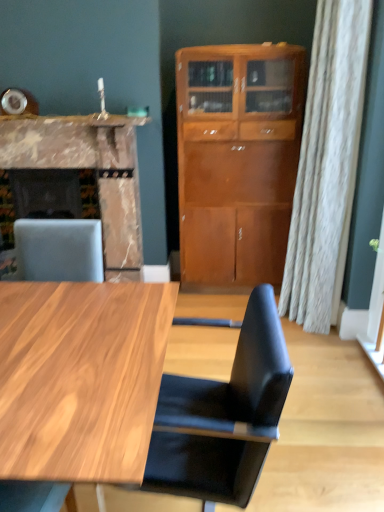
Question: Could you tell me if marble countertop at upper left is turned towards marble fireplace at left?

Choices:
 (A) yes
 (B) no

Answer: (B)

Question: Is marble countertop at upper left not near marble fireplace at left?

Choices:
 (A) no
 (B) yes

Answer: (A)

Question: Is marble countertop at upper left facing away from marble fireplace at left?

Choices:
 (A) yes
 (B) no

Answer: (B)

Question: From a real-world perspective, is marble countertop at upper left located higher than marble fireplace at left?

Choices:
 (A) yes
 (B) no

Answer: (A)

Question: From the image's perspective, is marble countertop at upper left below marble fireplace at left?

Choices:
 (A) no
 (B) yes

Answer: (A)

Question: Is marble countertop at upper left outside marble fireplace at left?

Choices:
 (A) yes
 (B) no

Answer: (A)

Question: Is light brown wood cabinet at center not within marble fireplace at left?

Choices:
 (A) no
 (B) yes

Answer: (B)

Question: Is light brown wood cabinet at center surrounding marble fireplace at left?

Choices:
 (A) yes
 (B) no

Answer: (B)

Question: Considering the relative positions of light brown wood cabinet at center and marble fireplace at left in the image provided, is light brown wood cabinet at center to the right of marble fireplace at left from the viewer's perspective?

Choices:
 (A) no
 (B) yes

Answer: (B)

Question: Is light brown wood cabinet at center positioned before marble fireplace at left?

Choices:
 (A) yes
 (B) no

Answer: (A)

Question: Is light brown wood cabinet at center wider than marble fireplace at left?

Choices:
 (A) yes
 (B) no

Answer: (B)

Question: Does light brown wood cabinet at center lie behind marble fireplace at left?

Choices:
 (A) no
 (B) yes

Answer: (A)

Question: Is the depth of black leather chair at center less than that of marble fireplace at left?

Choices:
 (A) yes
 (B) no

Answer: (A)